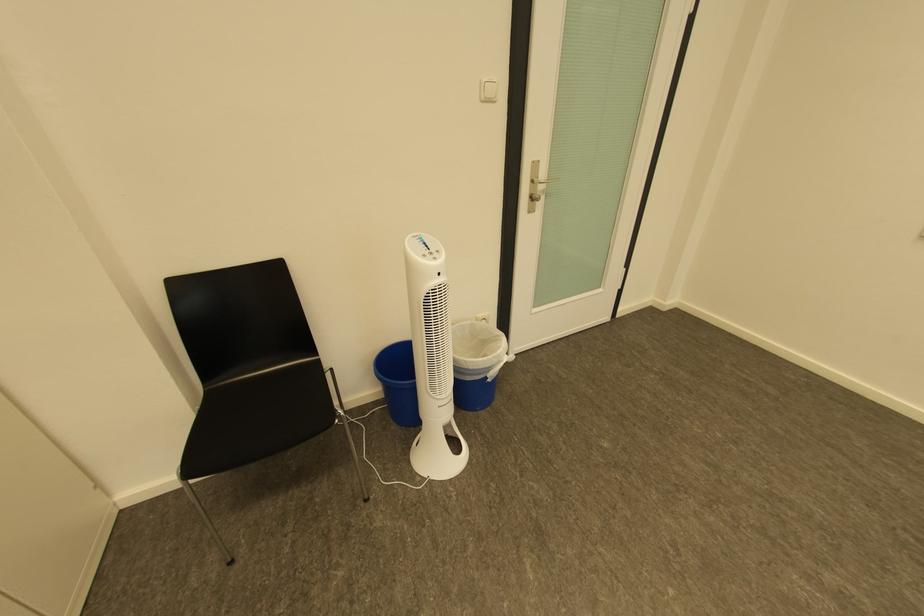
Find where to lift the trash bin. Please return your answer as a coordinate pair (x, y).

(477, 363)